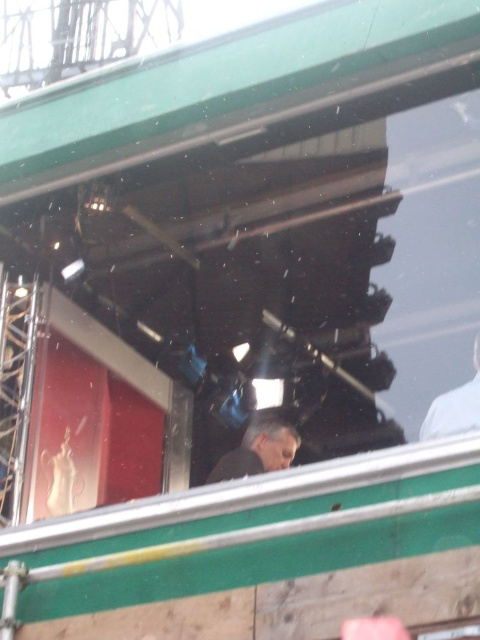
You are a passenger on a bus and notice the gray matte jacket at center. Can you determine if the jacket is closer to the front or the back of the bus based on its position?

The gray matte jacket at center is located at point (259,451), which suggests it is positioned towards the back of the bus since higher x and y coordinates typically indicate a more rearward position in such coordinate systems.

You are a passenger on a bus and want to take a photo of two points inside the vehicle. The first point is at coordinates point [283,468] and the second point is at point [466,385]. Which point is closer to your camera lens?

Point [466,385] is closer to the camera lens because it is less further away than point [283,468] according to the description.

You are a passenger on a bus during a snowstorm and notice two items inside the vehicle. The gray matte jacket at center and the white matte shirt at upper right. Which item takes up more space in the vehicle?

The white matte shirt at upper right takes up more space in the vehicle than the gray matte jacket at center because the gray matte jacket at center occupies less space than white matte shirt at upper right.